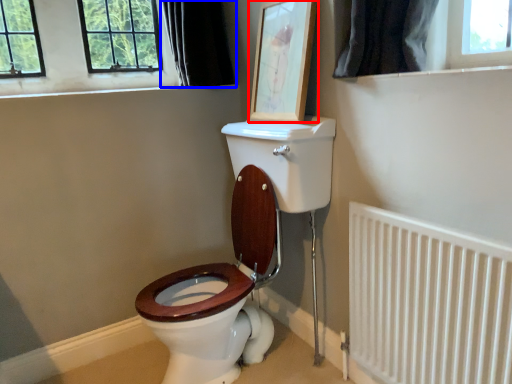
Question: Which object is closer to the camera taking this photo, picture frame (highlighted by a red box) or curtain (highlighted by a blue box)?

Choices:
 (A) picture frame
 (B) curtain

Answer: (A)